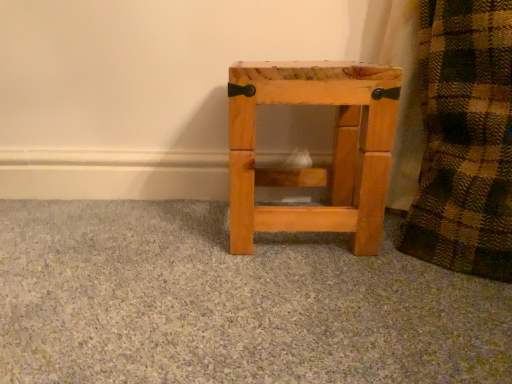
At what (x,y) coordinates should I click in order to perform the action: click on vacant region to the left of natural wood stool at center. Please return your answer as a coordinate pair (x, y). This screenshot has width=512, height=384. Looking at the image, I should click on (166, 225).